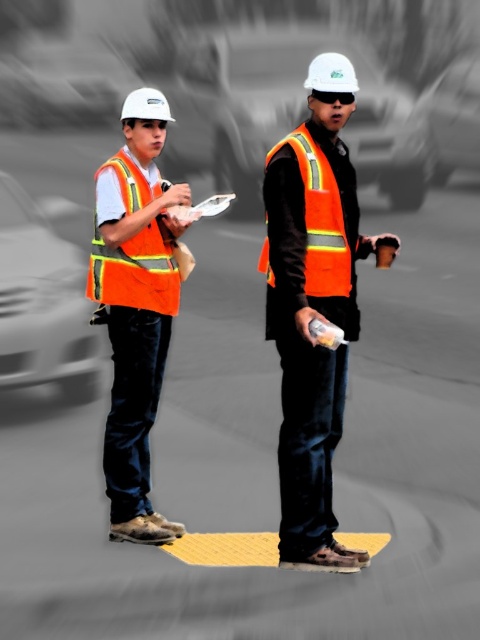
Question: Is high-visibility reflective safety vest at left below high-visibility reflective safety vest at center?

Choices:
 (A) no
 (B) yes

Answer: (B)

Question: Which point appears farthest from the camera in this image?

Choices:
 (A) [133, 163]
 (B) [126, 262]

Answer: (A)

Question: Among these points, which one is nearest to the camera?

Choices:
 (A) (132, 150)
 (B) (227, 184)
 (C) (303, 188)
 (D) (131, 301)

Answer: (C)

Question: Does high-visibility reflective safety vest at left appear under high-visibility reflective safety vest at center?

Choices:
 (A) no
 (B) yes

Answer: (B)

Question: Among these objects, which one is nearest to the camera?

Choices:
 (A) orange reflective vest at center
 (B) metallic silver car at center
 (C) orange reflective vest at left
 (D) high-visibility reflective safety vest at center

Answer: (A)

Question: Does metallic silver car at center have a smaller size compared to high-visibility reflective safety vest at center?

Choices:
 (A) yes
 (B) no

Answer: (B)